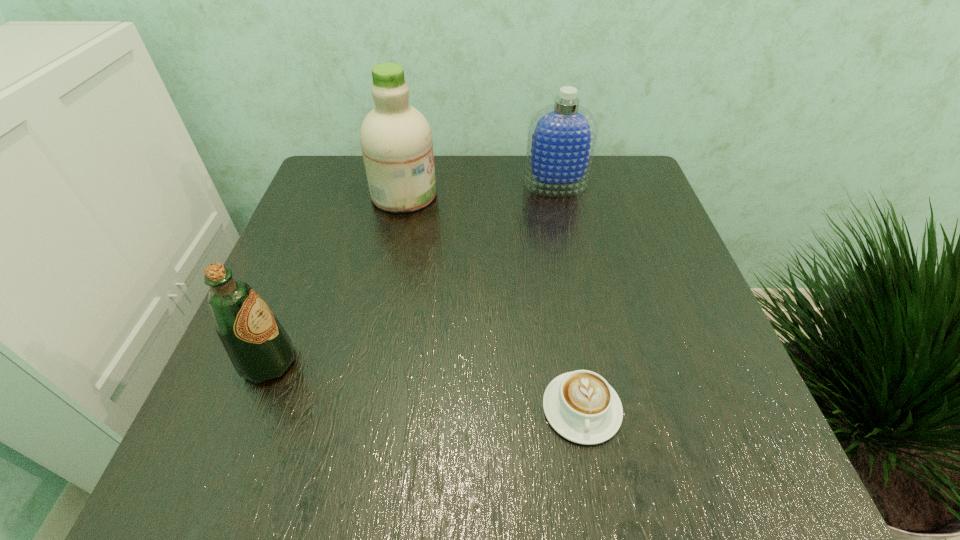
This screenshot has height=540, width=960. I want to click on vacant area at the far right corner of the desktop, so click(633, 184).

You are a GUI agent. You are given a task and a screenshot of the screen. Output one action in this format:
    pyautogui.click(x=<x>, y=<y>)
    Task: Click on the free point between the leftmost object and the taller cleansing agent
    
    Given the screenshot: What is the action you would take?
    pyautogui.click(x=337, y=279)

Locate an element on the screen. The height and width of the screenshot is (540, 960). vacant area between the leftmost object and the shorter cleansing agent is located at coordinates pos(412,273).

The width and height of the screenshot is (960, 540). In order to click on vacant area that lies between the shortest object and the olive oil in this screenshot , I will do `click(425, 386)`.

Where is `free space between the shortest object and the shorter cleansing agent`? Image resolution: width=960 pixels, height=540 pixels. free space between the shortest object and the shorter cleansing agent is located at coordinates (568, 296).

At what (x,y) coordinates should I click in order to perform the action: click on empty space between the shorter cleansing agent and the left cleansing agent. Please return your answer as a coordinate pair (x, y). Looking at the image, I should click on (480, 190).

Locate an element on the screen. The height and width of the screenshot is (540, 960). free area in between the leftmost object and the tallest object is located at coordinates (337, 279).

At what (x,y) coordinates should I click in order to perform the action: click on free space between the right cleansing agent and the taller cleansing agent. Please return your answer as a coordinate pair (x, y). Image resolution: width=960 pixels, height=540 pixels. Looking at the image, I should click on (480, 190).

At what (x,y) coordinates should I click in order to perform the action: click on vacant space in between the left cleansing agent and the olive oil. Please return your answer as a coordinate pair (x, y). The height and width of the screenshot is (540, 960). Looking at the image, I should click on (337, 279).

Locate an element on the screen. vacant point located between the cappuccino and the leftmost object is located at coordinates (425, 386).